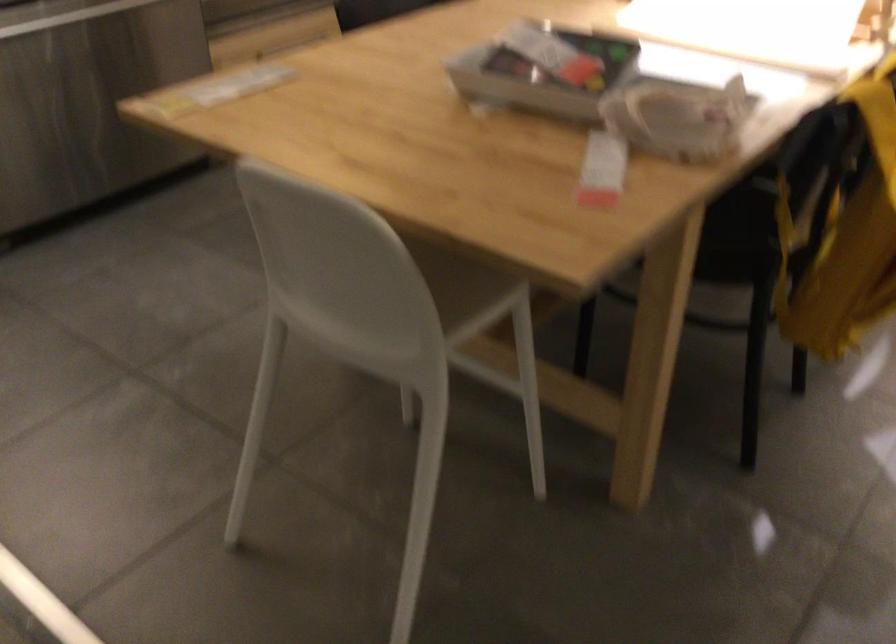
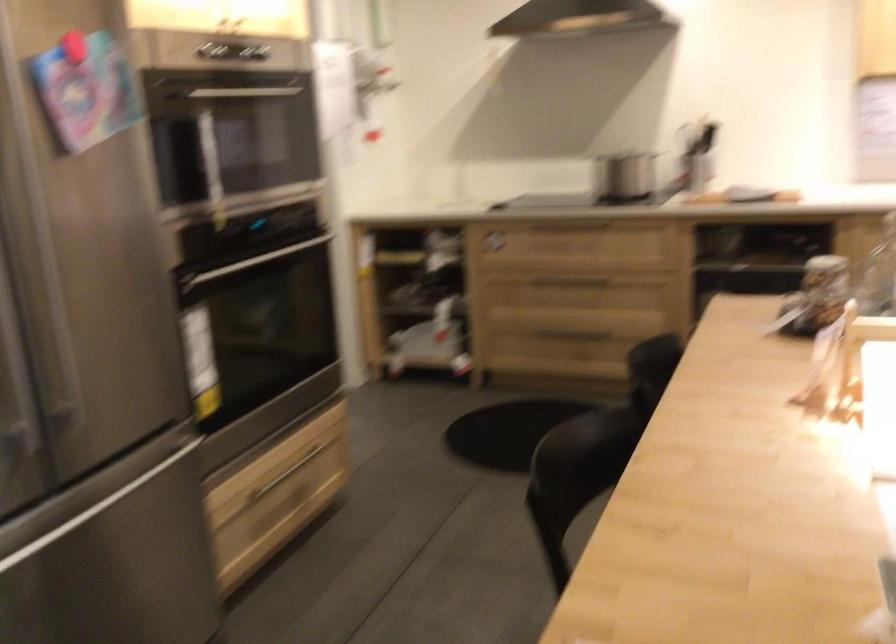
Question: The images are taken continuously from a first-person perspective. In which direction is your viewpoint rotating?

Choices:
 (A) Left
 (B) Right
 (C) Up
 (D) Down

Answer: (C)